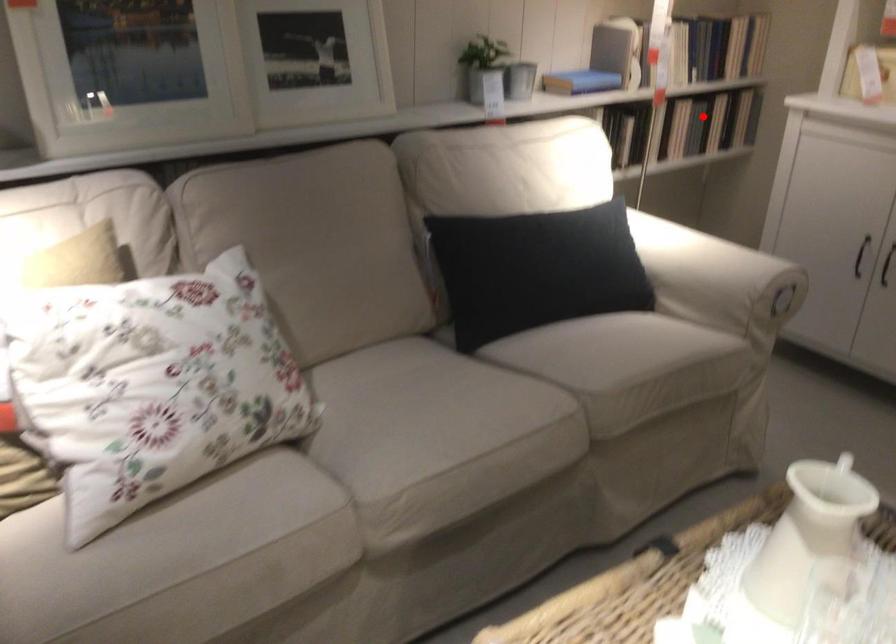
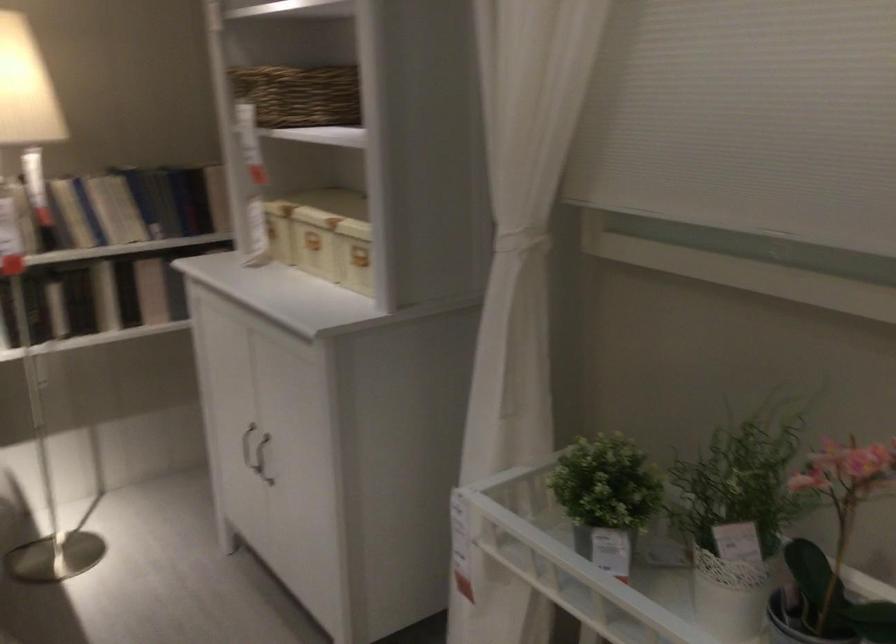
In the second image, find the point that corresponds to the highlighted location in the first image.

(151, 290)